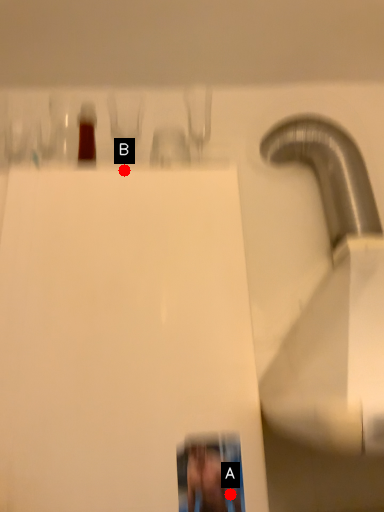
Question: Two points are circled on the image, labeled by A and B beside each circle. Which point is further to the camera?

Choices:
 (A) A is further
 (B) B is further

Answer: (B)